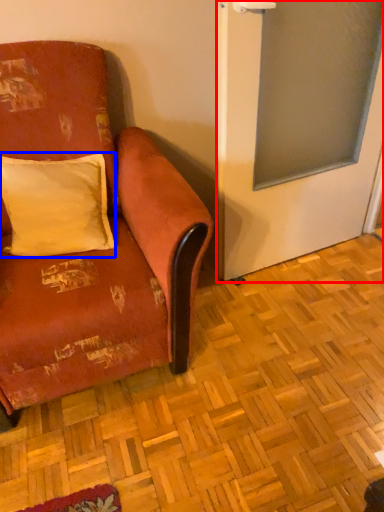
Question: Which point is closer to the camera, screen door (highlighted by a red box) or pillow (highlighted by a blue box)?

Choices:
 (A) screen door
 (B) pillow

Answer: (A)